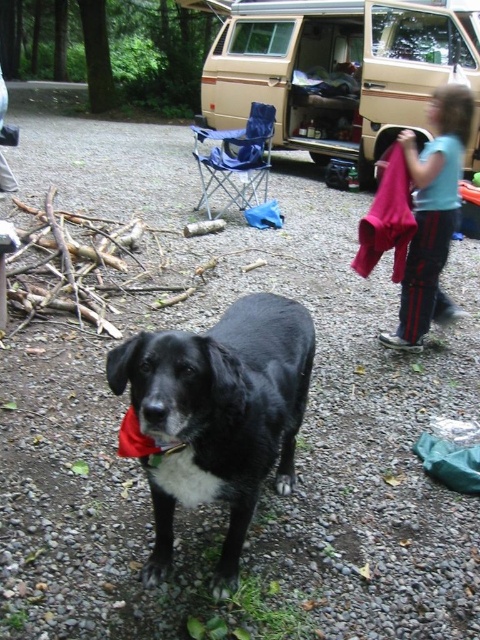
Question: Is black matte dog at center to the left of red fabric neckband at center from the viewer's perspective?

Choices:
 (A) yes
 (B) no

Answer: (B)

Question: Observing the image, what is the correct spatial positioning of beige fabric van at center in reference to black matte dog at center?

Choices:
 (A) right
 (B) left

Answer: (A)

Question: Can you confirm if black matte dog at center is positioned to the left of blue cotton shirt at upper right?

Choices:
 (A) no
 (B) yes

Answer: (B)

Question: Which point appears closest to the camera in this image?

Choices:
 (A) (454, 129)
 (B) (324, 125)
 (C) (121, 426)

Answer: (C)

Question: Estimate the real-world distances between objects in this image. Which object is farther from the red fabric neckband at center?

Choices:
 (A) beige fabric van at center
 (B) black matte dog at center

Answer: (A)

Question: Which object is the closest to the beige fabric van at center?

Choices:
 (A) red fabric neckband at center
 (B) blue cotton shirt at upper right
 (C) black matte dog at center

Answer: (B)